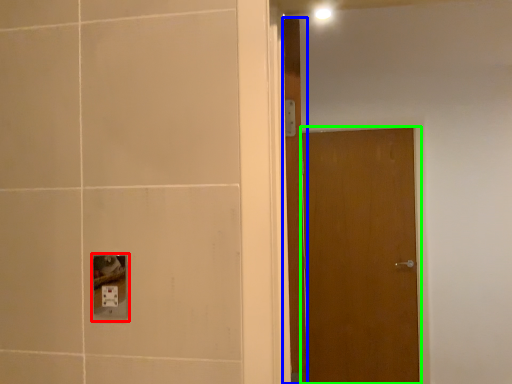
Question: Considering the real-world distances, which object is farthest from socket (highlighted by a red box)? door (highlighted by a blue box) or door (highlighted by a green box)?

Choices:
 (A) door
 (B) door

Answer: (B)